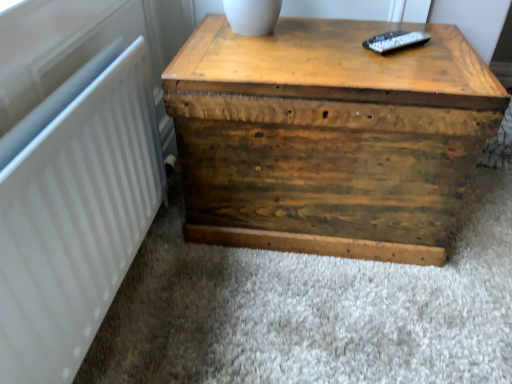
What is the approximate width of wooden trunk at center?

wooden trunk at center is 23.41 inches wide.

Find the location of a particular element. The image size is (512, 384). wooden trunk at center is located at coordinates (328, 137).

What do you see at coordinates (328, 137) in the screenshot? This screenshot has height=384, width=512. I see `wooden trunk at center` at bounding box center [328, 137].

In the scene shown: What is the approximate height of white matte radiator at left?

The height of white matte radiator at left is 20.71 inches.

Locate an element on the screen. The image size is (512, 384). white matte radiator at left is located at coordinates (76, 221).

Describe the element at coordinates (76, 221) in the screenshot. I see `white matte radiator at left` at that location.

Locate an element on the screen. This screenshot has width=512, height=384. wooden trunk at center is located at coordinates (328, 137).

Is wooden trunk at center to the left of white matte radiator at left from the viewer's perspective?

In fact, wooden trunk at center is to the right of white matte radiator at left.

Is wooden trunk at center closer to the viewer compared to white matte radiator at left?

No, wooden trunk at center is further to the viewer.

Does point (431, 98) lie behind point (18, 202)?

Yes, it is behind point (18, 202).

From the image's perspective, which one is positioned lower, wooden trunk at center or white matte radiator at left?

white matte radiator at left.

From a real-world perspective, is wooden trunk at center on white matte radiator at left?

No, from a real-world perspective, wooden trunk at center is not on top of white matte radiator at left.

Which of these two, wooden trunk at center or white matte radiator at left, is wider?

wooden trunk at center.

Can you confirm if wooden trunk at center is taller than white matte radiator at left?

Yes, wooden trunk at center is taller than white matte radiator at left.

Does wooden trunk at center have a smaller size compared to white matte radiator at left?

Actually, wooden trunk at center might be larger than white matte radiator at left.

Which is correct: wooden trunk at center is inside white matte radiator at left, or outside of it?

wooden trunk at center is not enclosed by white matte radiator at left.

In the scene shown: Does wooden trunk at center touch white matte radiator at left?

They are not placed beside each other.

Consider the image. Is wooden trunk at center looking in the opposite direction of white matte radiator at left?

No, wooden trunk at center is not facing the opposite direction of white matte radiator at left.

Can you tell me how much wooden trunk at center and white matte radiator at left differ in facing direction?

The angular difference between wooden trunk at center and white matte radiator at left is 89.9 degrees.

Find the location of `table above the white matte radiator at left (from the image's perspective)`. table above the white matte radiator at left (from the image's perspective) is located at coordinates (328, 137).

Is white matte radiator at left at the left side of wooden trunk at center?

Yes, white matte radiator at left is to the left of wooden trunk at center.

Does white matte radiator at left lie in front of wooden trunk at center?

Yes, white matte radiator at left is closer to the camera.

Does point (119, 102) appear closer or farther from the camera than point (301, 126)?

Point (119, 102) appears to be closer to the viewer than point (301, 126).

From the image's perspective, who appears lower, white matte radiator at left or wooden trunk at center?

white matte radiator at left.

From a real-world perspective, is white matte radiator at left physically above wooden trunk at center?

Indeed, from a real-world perspective, white matte radiator at left stands above wooden trunk at center.

In the scene shown: Does white matte radiator at left have a greater width compared to wooden trunk at center?

No.

Which of these two, white matte radiator at left or wooden trunk at center, stands shorter?

white matte radiator at left.

Based on their sizes in the image, would you say white matte radiator at left is bigger or smaller than wooden trunk at center?

In the image, white matte radiator at left appears to be smaller than wooden trunk at center.

Does white matte radiator at left contain wooden trunk at center?

No, wooden trunk at center is not inside white matte radiator at left.

Can you see white matte radiator at left touching wooden trunk at center?

white matte radiator at left is not next to wooden trunk at center, and they're not touching.

Is white matte radiator at left aimed at wooden trunk at center?

Yes, white matte radiator at left is oriented towards wooden trunk at center.

What's the angular difference between white matte radiator at left and wooden trunk at center's facing directions?

89.9 degrees separate the facing orientations of white matte radiator at left and wooden trunk at center.

Measure the distance between white matte radiator at left and wooden trunk at center.

The distance of white matte radiator at left from wooden trunk at center is 46.79 centimeters.

Find the location of `radiator below the wooden trunk at center (from the image's perspective)`. radiator below the wooden trunk at center (from the image's perspective) is located at coordinates click(x=76, y=221).

Where is `table on the right of white matte radiator at left`? table on the right of white matte radiator at left is located at coordinates [328, 137].

In order to click on table below the white matte radiator at left (from a real-world perspective) in this screenshot , I will do `click(328, 137)`.